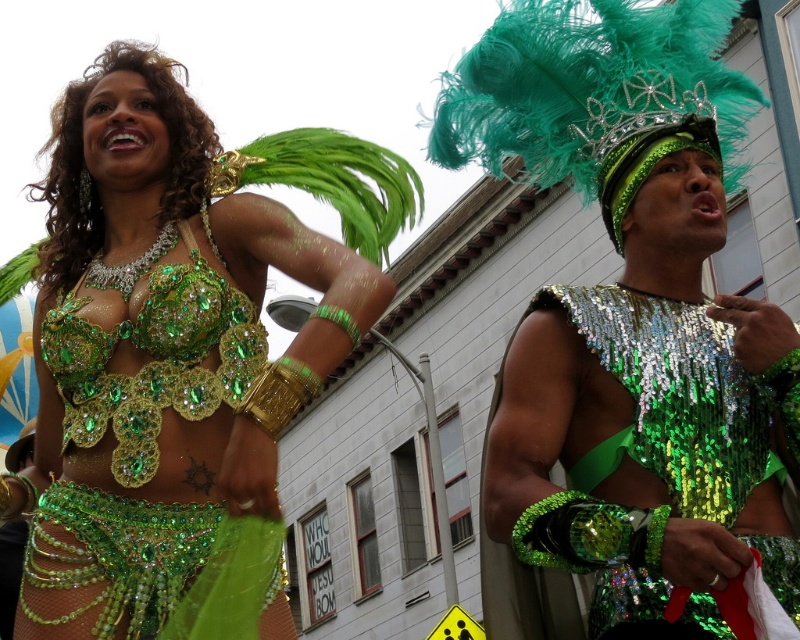
You are a photographer at the parade. You want to capture a photo that includes both the shiny sequin vest at center and the green sequined bikini top at upper left. Which object should you adjust your camera focus to ensure it appears in the foreground?

The shiny sequin vest at center should be in focus because the green sequined bikini top at upper left is behind it, meaning the vest is closer to the camera and thus in the foreground.

You are standing at the point marked at (248,205). You want to approach the woman in the green sequin costume. Given the distance between them, can you reach her in 10 seconds if you walk at a normal pace of 3 feet per second?

The distance between them is 172.23 feet. At 3 feet per second, it would take approximately 57.4 seconds to reach her, so no, you cannot reach her in 10 seconds.